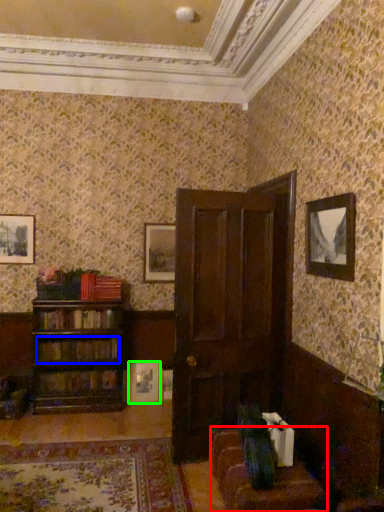
Question: Which object is the closest to the couch (highlighted by a red box)? Choose among these: book (highlighted by a blue box) or picture frame (highlighted by a green box).

Choices:
 (A) book
 (B) picture frame

Answer: (B)